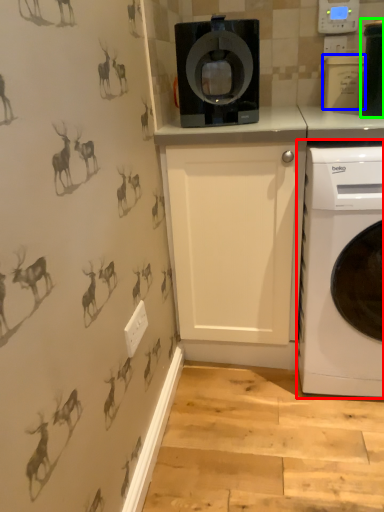
Question: Considering the real-world distances, which object is farthest from washing machine (highlighted by a red box)? appliance (highlighted by a blue box) or appliance (highlighted by a green box)?

Choices:
 (A) appliance
 (B) appliance

Answer: (A)